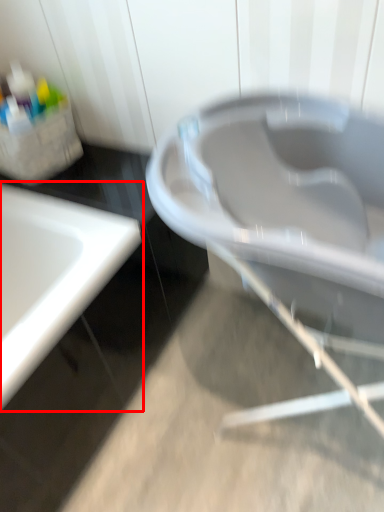
Question: From the image's perspective, where is sink (annotated by the red box) located relative to bath?

Choices:
 (A) below
 (B) above

Answer: (A)